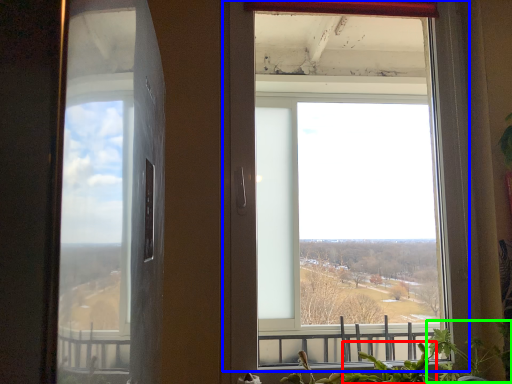
Question: Estimate the real-world distances between objects in this image. Which object is farther from plant (highlighted by a red box), window (highlighted by a blue box) or plant (highlighted by a green box)?

Choices:
 (A) window
 (B) plant

Answer: (A)